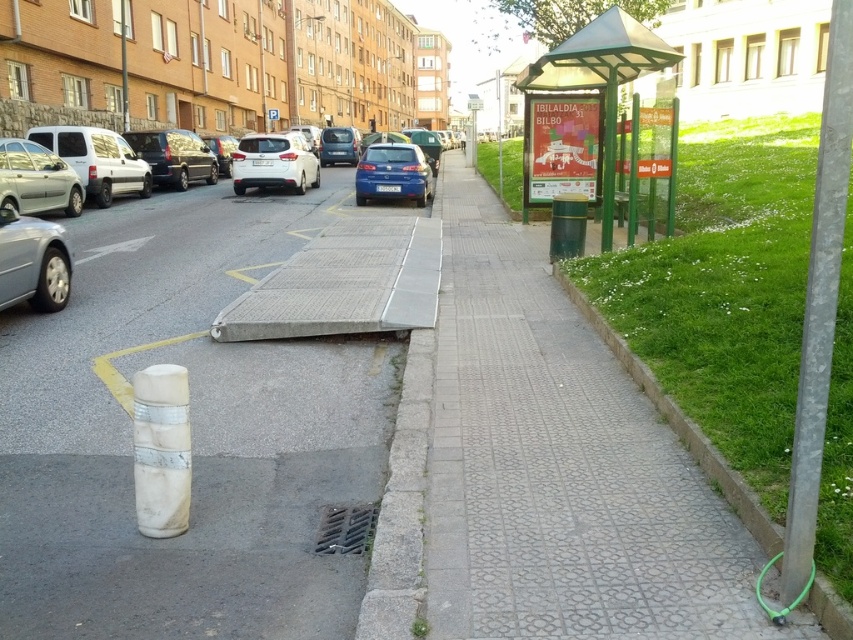
You are a delivery person who needs to place a 50 feet long banner between the green metallic bus stop at upper right and the white plastic parking sign at upper center. Can you fit the banner between them?

The distance between the green metallic bus stop at upper right and the white plastic parking sign at upper center is 45.83 feet, which is shorter than the 50 feet banner. Therefore, the banner cannot be placed between them.

You are a delivery person trying to determine the best place to park your electric scooter. You need to ensure it is visible from the road but also close to the green metallic bus stop at upper right and the green grass at lower right. Based on their heights, which object should you position your scooter closer to for better visibility?

The green metallic bus stop at upper right is much taller than the green grass at lower right, so positioning the scooter closer to the bus stop would provide better visibility from the road.

You are a pedestrian standing on the sidewalk and want to cross the road to reach the metallic silver car at left. Is the green metallic bus stop at upper right in your way?

The green metallic bus stop at upper right is located above the metallic silver car at left, so it is positioned higher up in the image but not necessarily blocking the path. The pedestrian can likely walk around or past the bus stop to reach the car.